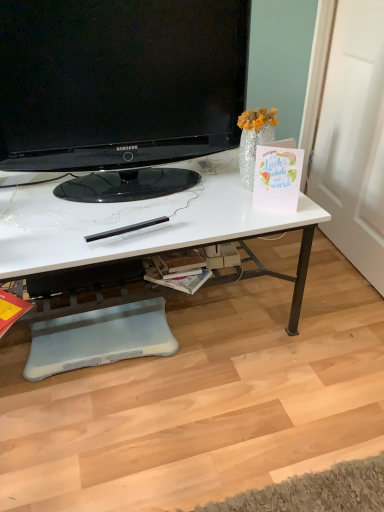
This screenshot has width=384, height=512. Find the location of `vacant space underneath black glossy television at upper center (from a real-world perspective)`. vacant space underneath black glossy television at upper center (from a real-world perspective) is located at coordinates (118, 188).